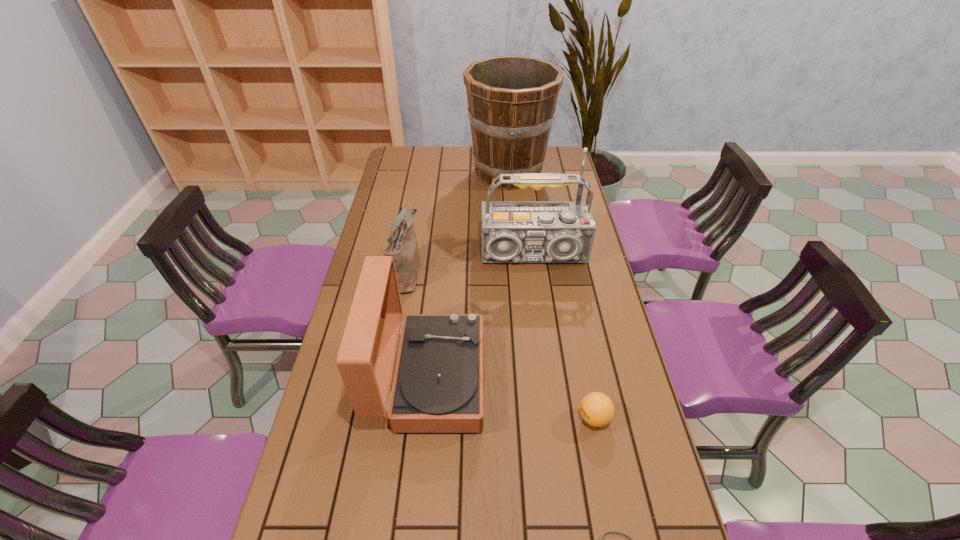
Image resolution: width=960 pixels, height=540 pixels. What are the coordinates of `free location located on the side with brand of the ping-pong ball` in the screenshot? It's located at 542,418.

Identify the location of vacant area situated on the side with brand of the ping-pong ball. The width and height of the screenshot is (960, 540). (546, 418).

Where is `vacant space situated on the side with brand of the ping-pong ball`? This screenshot has height=540, width=960. vacant space situated on the side with brand of the ping-pong ball is located at coordinates (512, 418).

The width and height of the screenshot is (960, 540). I want to click on object that is at the far edge, so point(511,99).

At what (x,y) coordinates should I click in order to perform the action: click on phonograph record at the left edge. Please return your answer as a coordinate pair (x, y). The height and width of the screenshot is (540, 960). Looking at the image, I should click on (438, 386).

This screenshot has height=540, width=960. What are the coordinates of `shoulder bag at the left edge` in the screenshot? It's located at (403, 247).

Find the location of a particular element. bucket located in the right edge section of the desktop is located at coordinates (511, 99).

Locate an element on the screen. Image resolution: width=960 pixels, height=540 pixels. radio receiver situated at the right edge is located at coordinates (512, 231).

The image size is (960, 540). In order to click on ping-pong ball positioned at the right edge in this screenshot , I will do `click(597, 409)`.

Identify the location of object that is at the far right corner. The width and height of the screenshot is (960, 540). (511, 99).